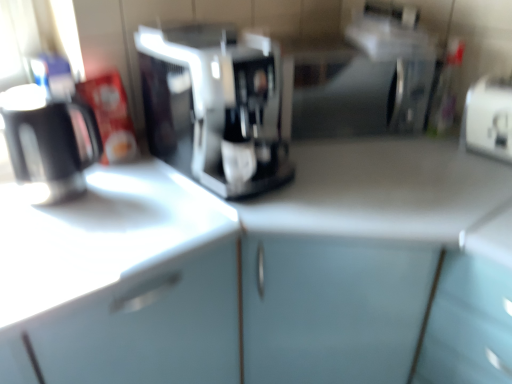
This screenshot has height=384, width=512. What are the coordinates of `free spot to the right of sleek silver coffee maker at center` in the screenshot? It's located at (344, 171).